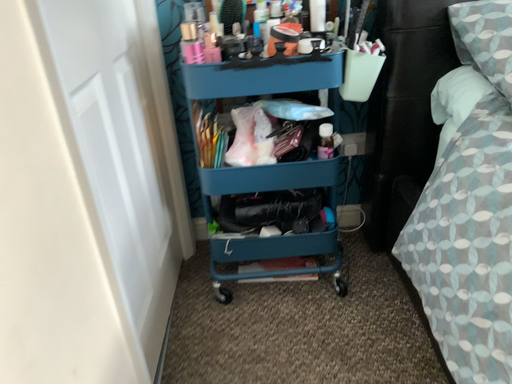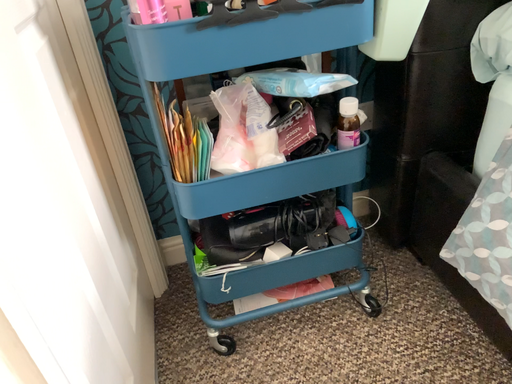
Question: How did the camera likely rotate when shooting the video?

Choices:
 (A) rotated right
 (B) rotated left

Answer: (A)